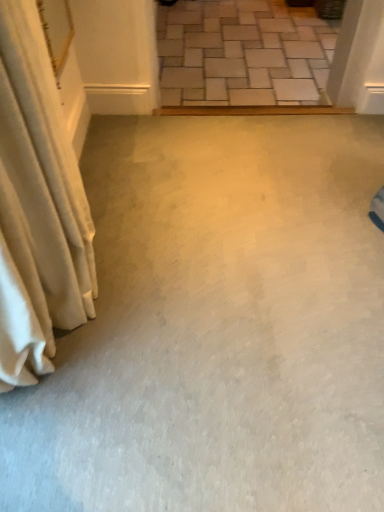
Question: Would you say light gray stone steps at upper center contains white fabric curtain at left?

Choices:
 (A) yes
 (B) no

Answer: (B)

Question: Is light gray stone steps at upper center not close to white fabric curtain at left?

Choices:
 (A) no
 (B) yes

Answer: (B)

Question: Is light gray stone steps at upper center taller than white fabric curtain at left?

Choices:
 (A) yes
 (B) no

Answer: (B)

Question: Is light gray stone steps at upper center in contact with white fabric curtain at left?

Choices:
 (A) no
 (B) yes

Answer: (A)

Question: Does light gray stone steps at upper center appear on the right side of white fabric curtain at left?

Choices:
 (A) no
 (B) yes

Answer: (B)

Question: From the image's perspective, does light gray stone steps at upper center appear lower than white fabric curtain at left?

Choices:
 (A) no
 (B) yes

Answer: (A)

Question: Is white fabric curtain at left further to the viewer compared to light gray stone steps at upper center?

Choices:
 (A) no
 (B) yes

Answer: (A)

Question: Can you confirm if white fabric curtain at left is taller than light gray stone steps at upper center?

Choices:
 (A) no
 (B) yes

Answer: (B)

Question: Is white fabric curtain at left oriented towards light gray stone steps at upper center?

Choices:
 (A) no
 (B) yes

Answer: (A)

Question: From a real-world perspective, is white fabric curtain at left located higher than light gray stone steps at upper center?

Choices:
 (A) no
 (B) yes

Answer: (B)

Question: Does white fabric curtain at left have a lesser width compared to light gray stone steps at upper center?

Choices:
 (A) no
 (B) yes

Answer: (B)

Question: Can you confirm if white fabric curtain at left is positioned to the left of light gray stone steps at upper center?

Choices:
 (A) yes
 (B) no

Answer: (A)

Question: Is light gray stone steps at upper center taller or shorter than white fabric curtain at left?

Choices:
 (A) tall
 (B) short

Answer: (B)